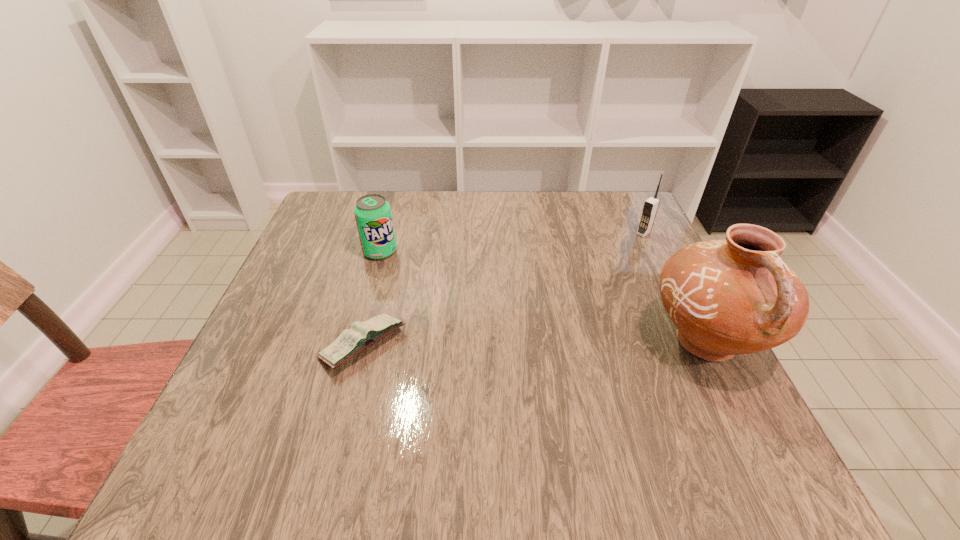
Image resolution: width=960 pixels, height=540 pixels. Find the location of `free spot located 0.280m on the front-facing side of the pop soda`. free spot located 0.280m on the front-facing side of the pop soda is located at coordinates (467, 319).

Where is `vacant region located on the front-facing side of the pop soda`? This screenshot has height=540, width=960. vacant region located on the front-facing side of the pop soda is located at coordinates (470, 321).

Image resolution: width=960 pixels, height=540 pixels. Identify the location of vacant point located 0.350m on the front-facing side of the pop soda. (491, 337).

Where is `object located in the far edge section of the desktop`? Image resolution: width=960 pixels, height=540 pixels. object located in the far edge section of the desktop is located at coordinates (651, 205).

The image size is (960, 540). Identify the location of object present at the near edge. (730, 297).

Identify the location of object that is at the left edge. The height and width of the screenshot is (540, 960). (361, 335).

Locate an element on the screen. pottery at the right edge is located at coordinates (730, 297).

Where is `cellular telephone at the right edge`? The height and width of the screenshot is (540, 960). cellular telephone at the right edge is located at coordinates (651, 205).

You are a GUI agent. You are given a task and a screenshot of the screen. Output one action in this format:
    pyautogui.click(x=<x>, y=<y>)
    Task: Click on the object present at the far right corner
    This screenshot has height=540, width=960.
    Given the screenshot: What is the action you would take?
    pyautogui.click(x=651, y=205)

At what (x,y) coordinates should I click in order to perform the action: click on object that is at the near right corner. Please return your answer as a coordinate pair (x, y). Image resolution: width=960 pixels, height=540 pixels. Looking at the image, I should click on (730, 297).